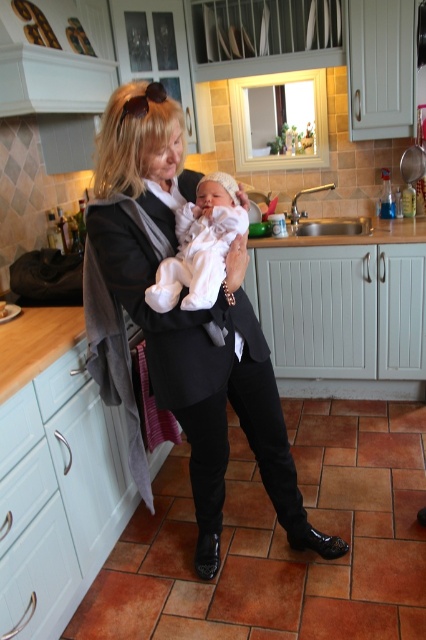
Question: Which of the following is the farthest from the observer?

Choices:
 (A) (233, 232)
 (B) (201, 508)

Answer: (B)

Question: Which object is farther from the camera taking this photo?

Choices:
 (A) white soft fabric newborn at center
 (B) black smooth business suit at center

Answer: (B)

Question: Is the position of black smooth business suit at center less distant than that of white soft fabric newborn at center?

Choices:
 (A) no
 (B) yes

Answer: (A)

Question: Can you confirm if black smooth business suit at center is wider than white soft fabric newborn at center?

Choices:
 (A) yes
 (B) no

Answer: (A)

Question: Does black smooth business suit at center have a greater width compared to white soft fabric newborn at center?

Choices:
 (A) no
 (B) yes

Answer: (B)

Question: Which point is farther from the camera taking this photo?

Choices:
 (A) (187, 195)
 (B) (192, 296)

Answer: (A)